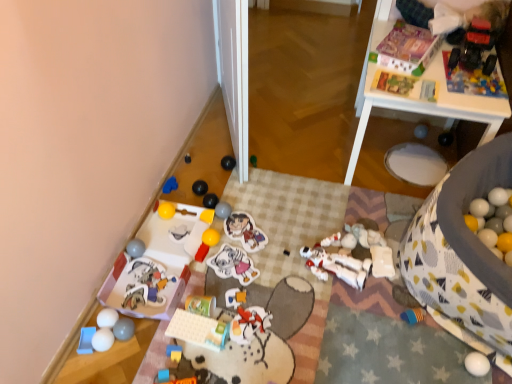
At what (x,y) coordinates should I click in order to perform the action: click on free region on the left part of matte plastic toy at lower left, which appears as the 22th toy when viewed from the right. Please return your answer as a coordinate pair (x, y). The height and width of the screenshot is (384, 512). Looking at the image, I should click on (106, 293).